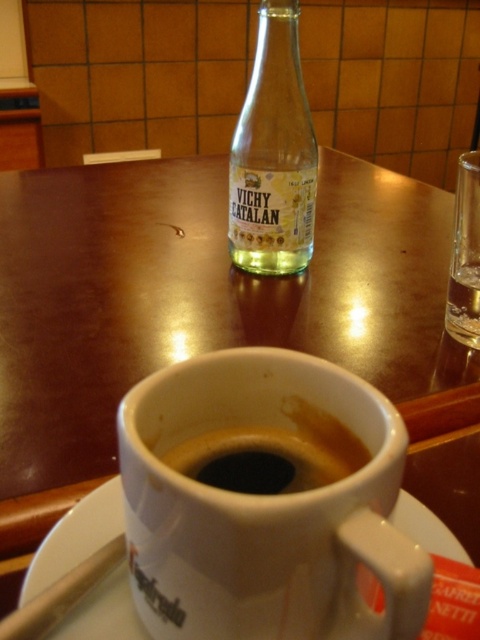
You are a customer at the table and want to place your phone on the table without covering any items. The black matte coffee at center is at point 0.722, 0.533. Where should you place your phone?

The black matte coffee at center is located at point (255,461). To place your phone without covering any items, choose a spot on the table that is not occupied by the black matte coffee at center or other objects like the saucer, spoon, or any items mentioned in the scene description.

You are a barista arranging items on a table. You have a white matte mug at center and a white ceramic saucer at lower center. According to the arrangement, which item is placed more to the right?

The white matte mug at center is positioned on the right side of the white ceramic saucer at lower center, so the white matte mug at center is placed more to the right.

You are a customer at a cafe and want to pour water from the clear glass bottle at center into the black matte coffee at center. Can you fit the bottle into the coffee cup without spilling?

The clear glass bottle at center is taller than black matte coffee at center, so it cannot fit inside the coffee cup. You should pour the water carefully without placing the bottle inside.